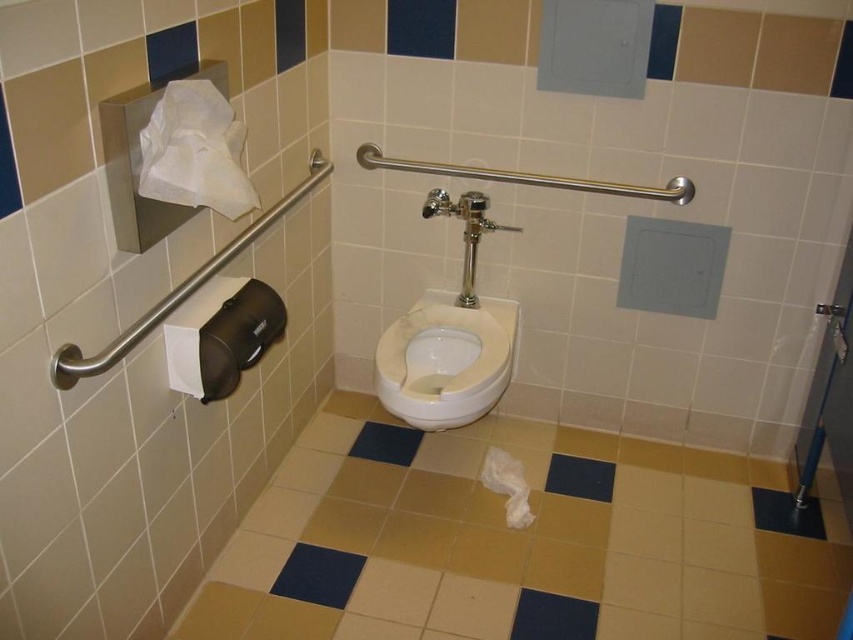
Between white matte toilet paper at left and white fluffy toilet paper at lower center, which one is positioned lower?

white fluffy toilet paper at lower center is lower down.

Consider the image. Which is above, white matte toilet paper at left or white fluffy toilet paper at lower center?

white matte toilet paper at left

Is point (231, 284) less distant than point (525, 512)?

Yes, point (231, 284) is closer to viewer.

Find the location of a particular element. white matte toilet paper at left is located at coordinates (221, 336).

From the picture: Can you confirm if white glossy toilet bowl at center is taller than white matte toilet paper at left?

Correct, white glossy toilet bowl at center is much taller as white matte toilet paper at left.

Between point (393, 397) and point (265, 288), which one is positioned behind?

The point (393, 397) is behind.

You are a GUI agent. You are given a task and a screenshot of the screen. Output one action in this format:
    pyautogui.click(x=<x>, y=<y>)
    Task: Click on the white glossy toilet bowl at center
    Image resolution: width=853 pixels, height=640 pixels.
    Given the screenshot: What is the action you would take?
    pyautogui.click(x=445, y=360)

Is point (189, 173) more distant than point (506, 454)?

No, it is not.

Where is `white paper towel at upper left`? This screenshot has width=853, height=640. white paper towel at upper left is located at coordinates (194, 150).